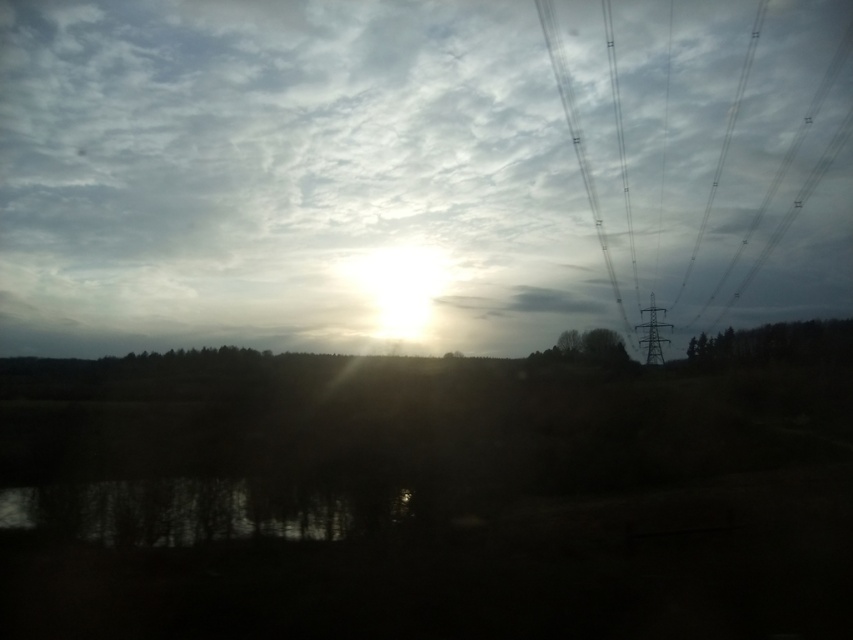
Which of these two, transparent glass water at bottom left or metallic wires at upper right, stands taller?

Standing taller between the two is metallic wires at upper right.

Can you confirm if transparent glass water at bottom left is shorter than metallic wires at upper right?

Indeed, transparent glass water at bottom left has a lesser height compared to metallic wires at upper right.

You are a GUI agent. You are given a task and a screenshot of the screen. Output one action in this format:
    pyautogui.click(x=<x>, y=<y>)
    Task: Click on the transparent glass water at bottom left
    The image size is (853, 640).
    Given the screenshot: What is the action you would take?
    pyautogui.click(x=195, y=509)

You are a GUI agent. You are given a task and a screenshot of the screen. Output one action in this format:
    pyautogui.click(x=<x>, y=<y>)
    Task: Click on the transparent glass water at bottom left
    Image resolution: width=853 pixels, height=640 pixels.
    Given the screenshot: What is the action you would take?
    pyautogui.click(x=195, y=509)

Is white fluffy cloud at upper center taller than metallic wires at upper right?

Yes, white fluffy cloud at upper center is taller than metallic wires at upper right.

Who is more distant from viewer, (306,29) or (553,26)?

The point (553,26) is behind.

Where is `white fluffy cloud at upper center`? The image size is (853, 640). white fluffy cloud at upper center is located at coordinates (413, 172).

Does metallic wires at upper right have a smaller size compared to metallic wire at upper right?

Indeed, metallic wires at upper right has a smaller size compared to metallic wire at upper right.

Can you confirm if metallic wires at upper right is shorter than metallic wire at upper right?

Yes, metallic wires at upper right is shorter than metallic wire at upper right.

Is point (569, 76) farther from camera compared to point (780, 172)?

That is False.

You are a GUI agent. You are given a task and a screenshot of the screen. Output one action in this format:
    pyautogui.click(x=<x>, y=<y>)
    Task: Click on the metallic wires at upper right
    
    Given the screenshot: What is the action you would take?
    pyautogui.click(x=579, y=150)